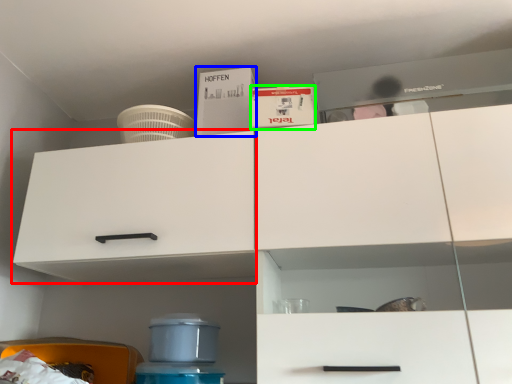
Question: Which object is the farthest from cabinetry (highlighted by a red box)? Choose among these: box (highlighted by a blue box) or box (highlighted by a green box).

Choices:
 (A) box
 (B) box

Answer: (B)